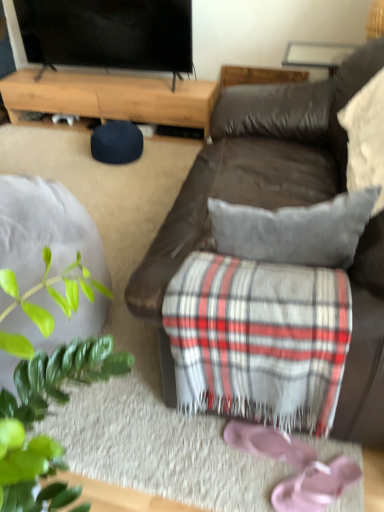
Question: Does flat screen tv at upper left have a larger size compared to white textured pillow at upper right?

Choices:
 (A) yes
 (B) no

Answer: (A)

Question: From the image's perspective, is flat screen tv at upper left located beneath white textured pillow at upper right?

Choices:
 (A) yes
 (B) no

Answer: (B)

Question: Is flat screen tv at upper left behind white textured pillow at upper right?

Choices:
 (A) yes
 (B) no

Answer: (A)

Question: Does flat screen tv at upper left turn towards white textured pillow at upper right?

Choices:
 (A) yes
 (B) no

Answer: (B)

Question: Considering the relative positions of flat screen tv at upper left and white textured pillow at upper right in the image provided, is flat screen tv at upper left to the right of white textured pillow at upper right from the viewer's perspective?

Choices:
 (A) yes
 (B) no

Answer: (B)

Question: Does point (377, 86) appear closer or farther from the camera than point (233, 437)?

Choices:
 (A) closer
 (B) farther

Answer: (B)

Question: In terms of size, does white textured pillow at upper right appear bigger or smaller than pink suede shoe at lower center?

Choices:
 (A) big
 (B) small

Answer: (A)

Question: Based on their positions, is white textured pillow at upper right located to the left or right of pink suede shoe at lower center?

Choices:
 (A) right
 (B) left

Answer: (A)

Question: Considering the positions of white textured pillow at upper right and pink suede shoe at lower center in the image, is white textured pillow at upper right wider or thinner than pink suede shoe at lower center?

Choices:
 (A) thin
 (B) wide

Answer: (A)

Question: Is pink suede shoe at lower center bigger or smaller than brown leather couch at center?

Choices:
 (A) big
 (B) small

Answer: (B)

Question: Is point (288, 461) closer or farther from the camera than point (284, 142)?

Choices:
 (A) closer
 (B) farther

Answer: (A)

Question: Considering the positions of pink suede shoe at lower center and brown leather couch at center in the image, is pink suede shoe at lower center wider or thinner than brown leather couch at center?

Choices:
 (A) thin
 (B) wide

Answer: (A)

Question: Which is correct: pink suede shoe at lower center is inside brown leather couch at center, or outside of it?

Choices:
 (A) inside
 (B) outside

Answer: (B)

Question: From the image's perspective, is light brown wood at upper left located above or below pink fabric flip-flops at lower right?

Choices:
 (A) below
 (B) above

Answer: (B)

Question: From a real-world perspective, relative to pink fabric flip-flops at lower right, is light brown wood at upper left vertically above or below?

Choices:
 (A) below
 (B) above

Answer: (B)